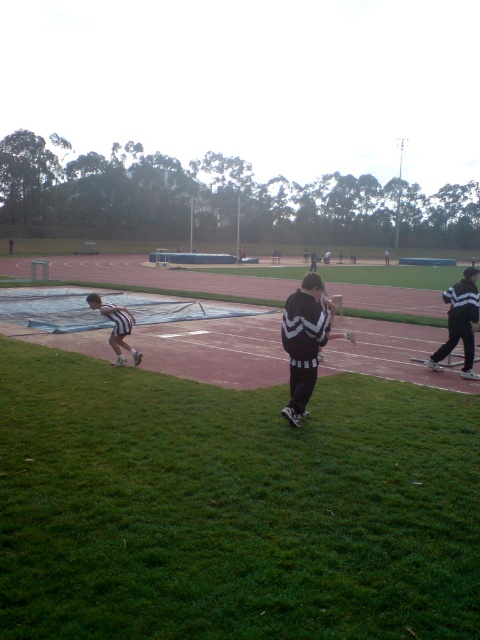
Does point (451, 342) lie behind point (124, 336)?

No, (451, 342) is closer to viewer.

Locate an element on the screen. This screenshot has height=640, width=480. black and white striped jacket at right is located at coordinates (459, 323).

You are a GUI agent. You are given a task and a screenshot of the screen. Output one action in this format:
    pyautogui.click(x=<x>, y=<y>)
    Task: Click on the black and white striped jacket at right
    Image resolution: width=480 pixels, height=640 pixels.
    Given the screenshot: What is the action you would take?
    pyautogui.click(x=459, y=323)

Which is above, black and white striped jacket at center or white athletic shorts at lower left?

black and white striped jacket at center

Is black and white striped jacket at center taller than white athletic shorts at lower left?

Correct, black and white striped jacket at center is much taller as white athletic shorts at lower left.

Identify the location of black and white striped jacket at center. (303, 340).

Who is lower down, black and white striped jacket at center or black and white striped jacket at right?

black and white striped jacket at center

Does point (300, 344) come behind point (466, 355)?

No, (300, 344) is in front of (466, 355).

At what (x,y) coordinates should I click in order to perform the action: click on black and white striped jacket at center. Please return your answer as a coordinate pair (x, y). The height and width of the screenshot is (640, 480). Looking at the image, I should click on (303, 340).